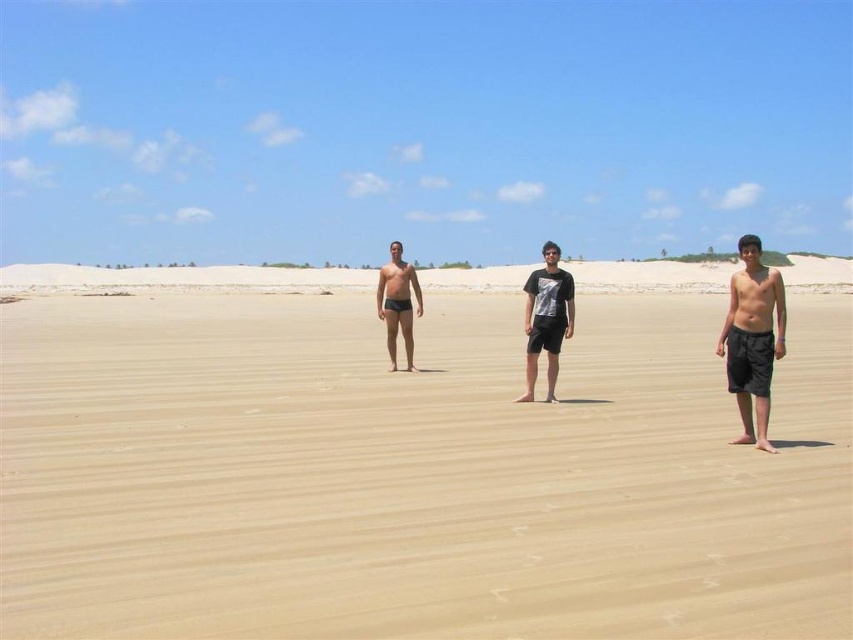
You are standing at the origin point in the image. There is a point marked at coordinate (752, 339). What object is located at that coordinate?

The point at coordinate (752, 339) corresponds to the matte black shorts at center.